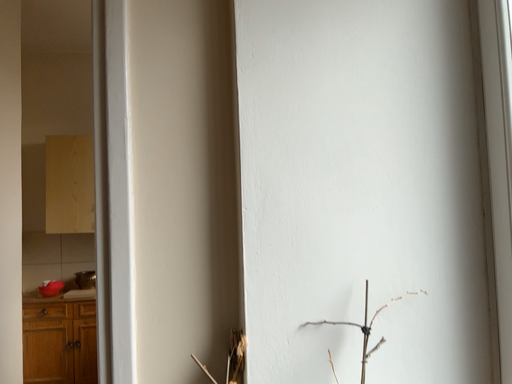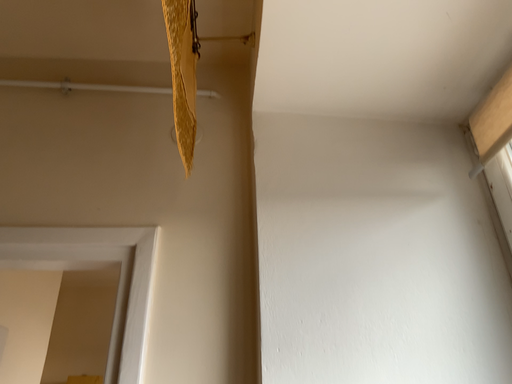
Question: How did the camera likely rotate when shooting the video?

Choices:
 (A) rotated downward
 (B) rotated upward

Answer: (B)